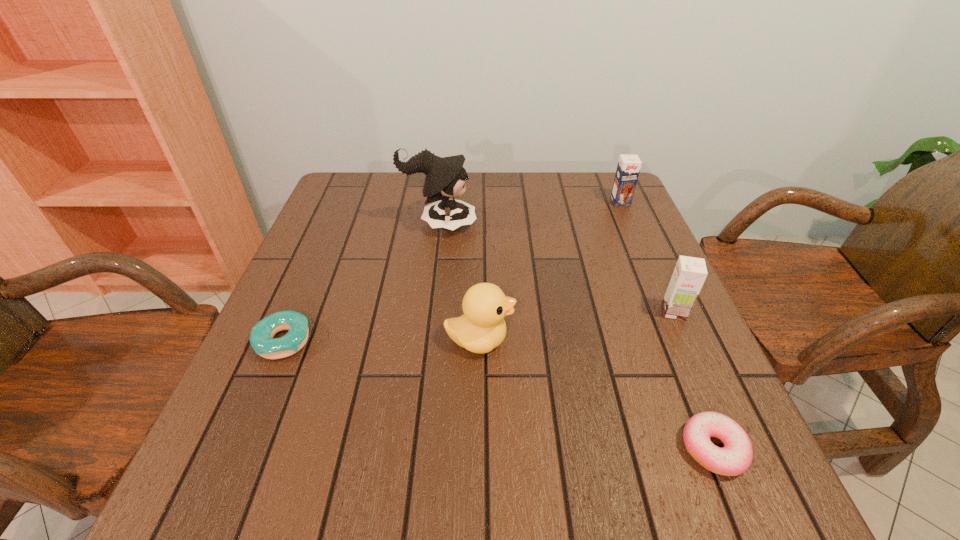
The height and width of the screenshot is (540, 960). In order to click on object that is positioned at the far right corner in this screenshot , I will do `click(628, 168)`.

Locate an element on the screen. This screenshot has width=960, height=540. object that is at the near right corner is located at coordinates (736, 456).

Identify the location of blank space at the far edge of the desktop. (518, 188).

Find the location of `vacant region at the near edge`. vacant region at the near edge is located at coordinates (550, 489).

Where is `blank space at the left edge`? blank space at the left edge is located at coordinates (217, 438).

Find the location of a particular element. This screenshot has width=960, height=540. vacant point at the right edge is located at coordinates (660, 296).

Locate an element on the screen. Image resolution: width=960 pixels, height=540 pixels. unoccupied position between the nearer chocolate milk and the nearer doughnut is located at coordinates (693, 380).

In order to click on vacant space in between the duck and the nearer chocolate milk in this screenshot , I will do `click(577, 326)`.

Locate an element on the screen. The height and width of the screenshot is (540, 960). vacant space that's between the farther chocolate milk and the right doughnut is located at coordinates (667, 325).

Identify the location of free space between the duck and the farther chocolate milk. (550, 271).